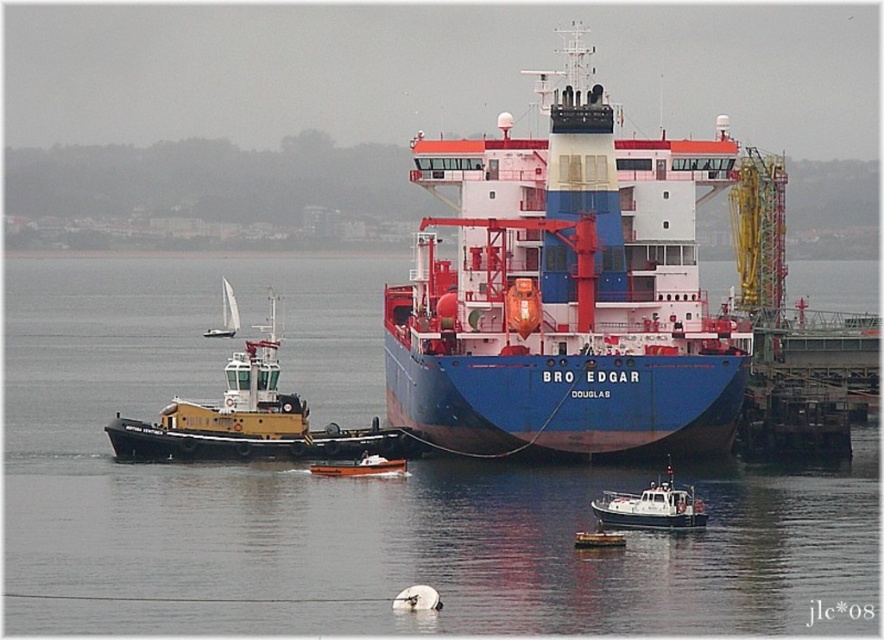
You are a photographer trying to capture the white plastic boat at lower right and the blue matte water at center in a single frame. Based on their positions, which object would appear closer to the camera?

The white plastic boat at lower right is closer to the camera than the blue matte water at center because objects positioned lower in the frame are typically closer to the viewer.

You are a port authority officer trying to locate the blue matte cargo ship at center in the image. What are its coordinates?

The blue matte cargo ship at center is located at coordinates (565, 291).

You are a port authority inspector tasked with ensuring safe navigation. You observe the blue matte cargo ship at center and the yellow matte tugboat at left in the port. Based on their sizes, which vessel requires a wider berth to avoid collisions with other ships?

The blue matte cargo ship at center requires a wider berth because its width is larger than the yellow matte tugboat at left, making it more prone to collisions in narrow spaces.